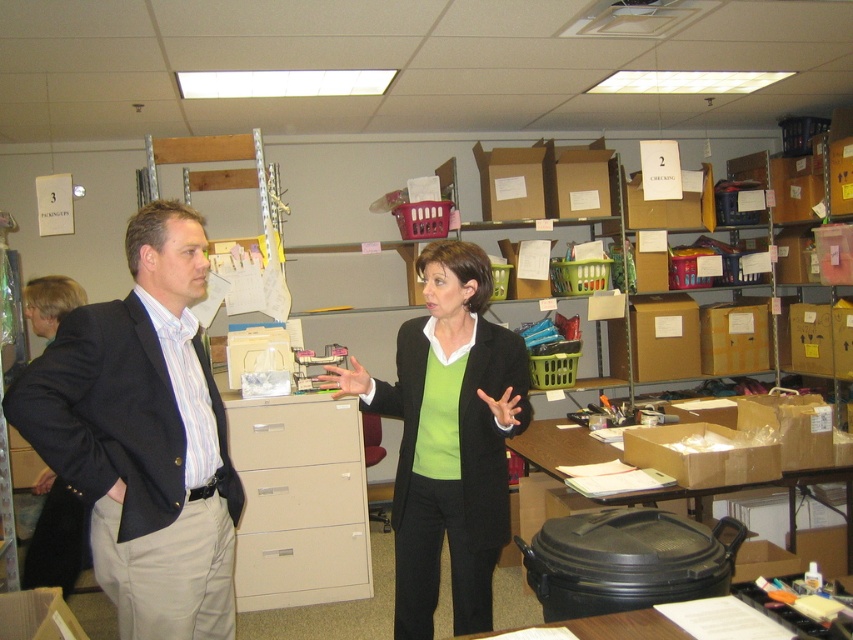
Does green matte blazer at center have a smaller size compared to beige matte drawer at center?

No.

Is green matte blazer at center thinner than beige matte drawer at center?

No.

Which is behind, point (430, 536) or point (306, 536)?

Positioned behind is point (306, 536).

This screenshot has width=853, height=640. I want to click on green matte blazer at center, so click(448, 438).

Does point (282, 604) come closer to viewer compared to point (283, 420)?

That is False.

Is beige plastic file cabinet at center positioned behind beige/file cabinet at center?

No, it is in front of beige/file cabinet at center.

Where is `beige plastic file cabinet at center`? beige plastic file cabinet at center is located at coordinates (299, 500).

From the picture: Can you confirm if dark blue suit at center is smaller than beige plastic file cabinet at center?

No.

This screenshot has width=853, height=640. What do you see at coordinates (144, 436) in the screenshot? I see `dark blue suit at center` at bounding box center [144, 436].

You are a GUI agent. You are given a task and a screenshot of the screen. Output one action in this format:
    pyautogui.click(x=<x>, y=<y>)
    Task: Click on the dark blue suit at center
    The height and width of the screenshot is (640, 853).
    Given the screenshot: What is the action you would take?
    pyautogui.click(x=144, y=436)